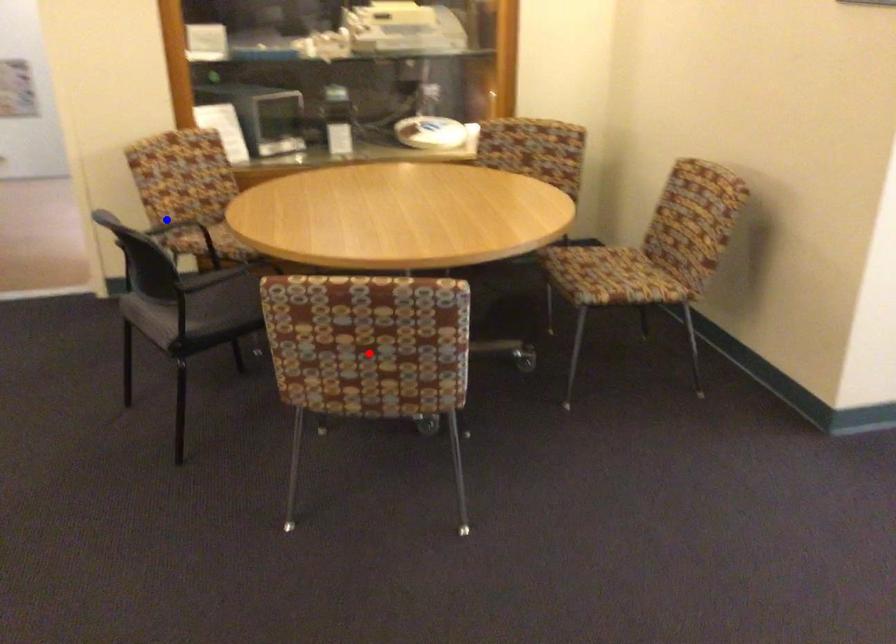
Question: In the image, two points are highlighted. Which point is nearer to the camera? Reply with the corresponding letter.

Choices:
 (A) blue point
 (B) red point

Answer: (B)